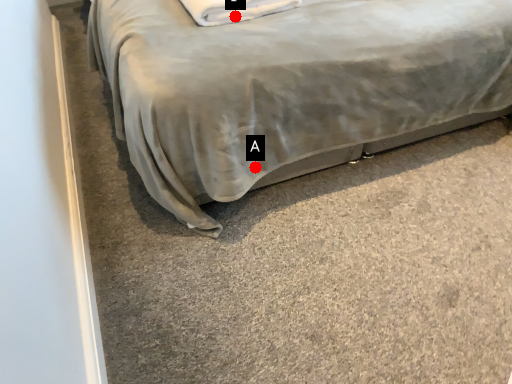
Question: Two points are circled on the image, labeled by A and B beside each circle. Which of the following is the farthest from the observer?

Choices:
 (A) A is further
 (B) B is further

Answer: (B)